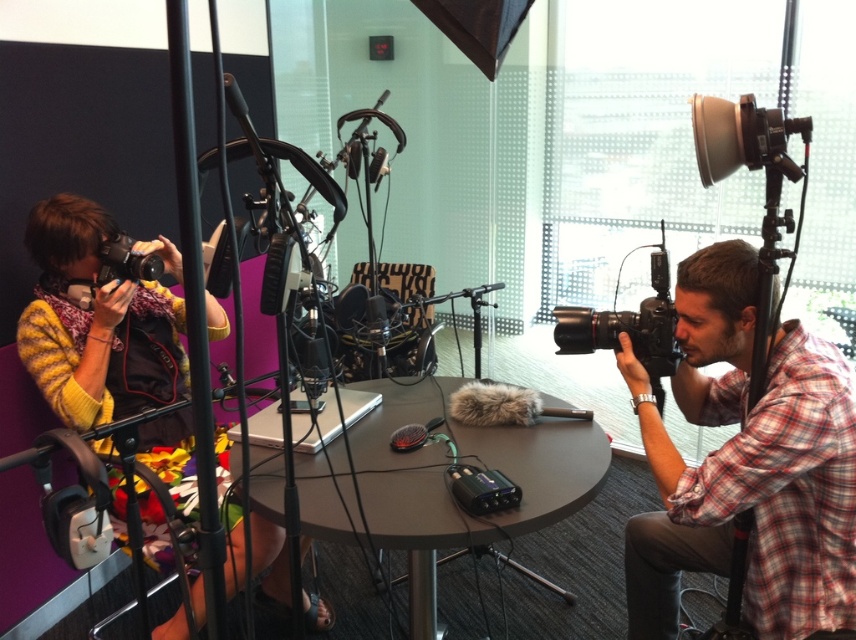
You are a photographer who needs to adjust the lighting for a photo shoot. You have a reflector that is 1.2 meters wide. You want to place it between the plaid shirt at right and the camera so that it can reflect light onto the subject. Is there enough space between them to fit the reflector without moving either the shirt or the camera?

The plaid shirt at right is 1.36 meters from the camera. Since the reflector is 1.2 meters wide, there is enough space between them to fit the reflector without moving either the shirt or the camera.

You are setting up a photography session and need to place a 20cm wide equipment box on the table. Given the plaid shirt at right and the matte gray table at center, which object has enough space to accommodate the box?

The matte gray table at center has enough space because the plaid shirt at right has a lesser width compared to matte gray table at center, making the table wider and more suitable for placing the box.

You are a photographer in a studio setting. You need to move a tripod from the yellow sweater at left to the black plastic camera at right. The tripod has a base diameter of 0.8 meters. Is there enough space to move the tripod between these two items without touching them?

The distance between the yellow sweater at left and the black plastic camera at right is 1.17 meters. The tripod requires at least 0.8 meters of space to move. Since 1.17 meters is greater than 0.8 meters, there is enough space to move the tripod between them without touching either item.